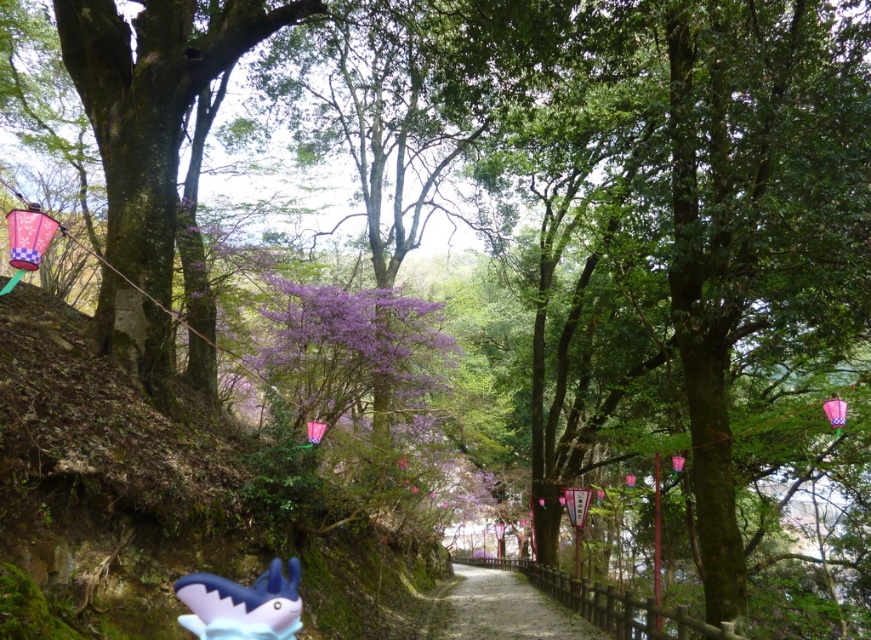
You are standing at the camera position and want to walk to the gravel path at center. How many steps would you need to take if each step covers 3 feet?

The distance between the camera and the gravel path at center is 31.21 feet. Each step covers 3 feet, so dividing 31.21 by 3 gives approximately 10.4 steps. Since you can only take whole steps, you would need to take 11 steps to reach the gravel path at center.

You are a hiker walking along the gravel path at center and notice a matte blue plastic shark at lower left. Which object is higher in elevation?

The gravel path at center is much taller than the matte blue plastic shark at lower left, so the gravel path at center has a higher elevation.

Consider the image. You are standing at the entrance of the forest and see the gravel path at center. Based on its 2D coordinates, can you determine if the path is positioned closer to the top or bottom of the image?

The gravel path at center is located at point 0.953 on the x and 0.579 on the y. Since the y coordinate is closer to 0.5, it is positioned closer to the bottom of the image.